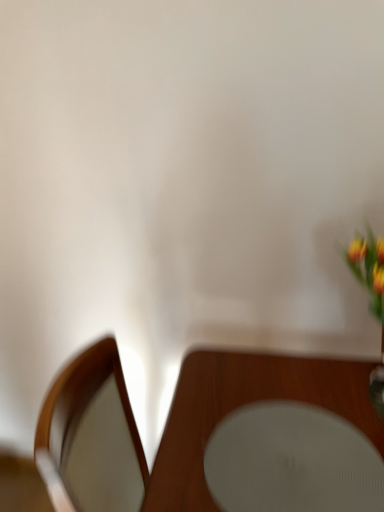
You are a GUI agent. You are given a task and a screenshot of the screen. Output one action in this format:
    pyautogui.click(x=<x>, y=<y>)
    Task: Click on the free point above white matte plate at center (from a real-world perspective)
    The width and height of the screenshot is (384, 512).
    Given the screenshot: What is the action you would take?
    pyautogui.click(x=284, y=441)